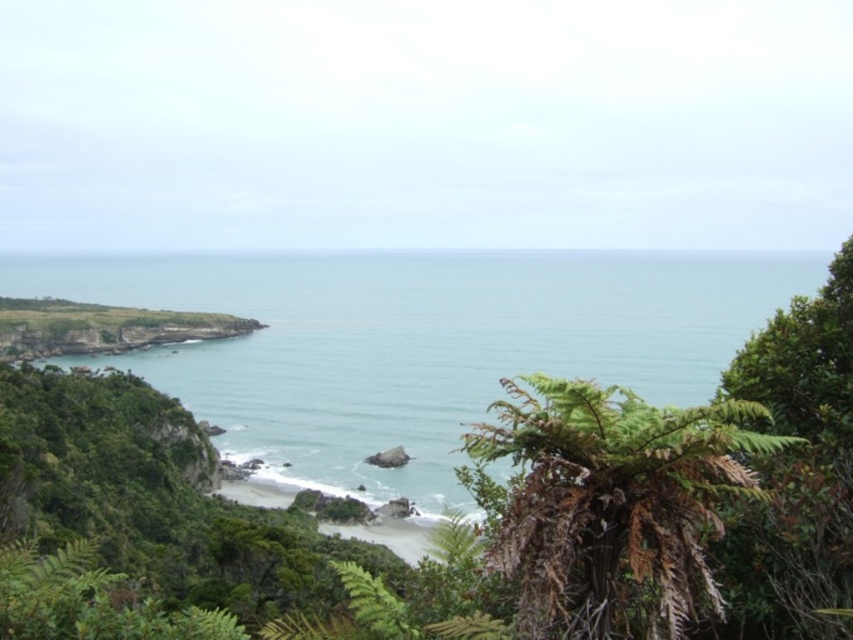
Question: Which point appears farthest from the camera in this image?

Choices:
 (A) (339, 272)
 (B) (352, 531)
 (C) (653, 456)

Answer: (A)

Question: Does green water at center have a lesser width compared to smooth sand beach at center?

Choices:
 (A) no
 (B) yes

Answer: (A)

Question: Estimate the real-world distances between objects in this image. Which object is closer to the smooth sand beach at center?

Choices:
 (A) green water at center
 (B) brown/dried leafy fern at lower right

Answer: (B)

Question: Is green water at center below brown/dried leafy fern at lower right?

Choices:
 (A) yes
 (B) no

Answer: (B)

Question: Which of the following is the farthest from the observer?

Choices:
 (A) (628, 508)
 (B) (230, 497)

Answer: (B)

Question: Considering the relative positions of green water at center and smooth sand beach at center in the image provided, where is green water at center located with respect to smooth sand beach at center?

Choices:
 (A) right
 (B) left

Answer: (A)